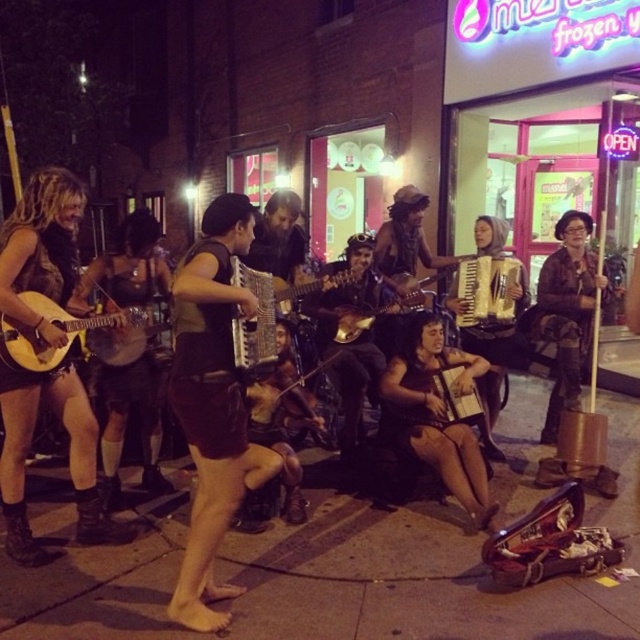
Question: Estimate the real-world distances between objects in this image. Which object is farther from the matte black guitar at left?

Choices:
 (A) shiny gold guitar at center
 (B) matte black skirt at center
 (C) wooden acoustic guitar at center

Answer: (C)

Question: Can you confirm if brown concrete pavement at center is positioned above matte brown accordion at center?

Choices:
 (A) yes
 (B) no

Answer: (B)

Question: Which point is closer to the camera taking this photo?

Choices:
 (A) (580, 259)
 (B) (477, 352)
 (C) (353, 388)

Answer: (C)

Question: Can you confirm if brown concrete pavement at center is positioned below wooden accordion at center?

Choices:
 (A) yes
 (B) no

Answer: (A)

Question: Which of the following is the closest to the observer?

Choices:
 (A) (134, 356)
 (B) (36, 561)
 (C) (340, 304)

Answer: (B)

Question: Does brown leather jacket at lower right come behind wooden acoustic guitar at left?

Choices:
 (A) yes
 (B) no

Answer: (A)